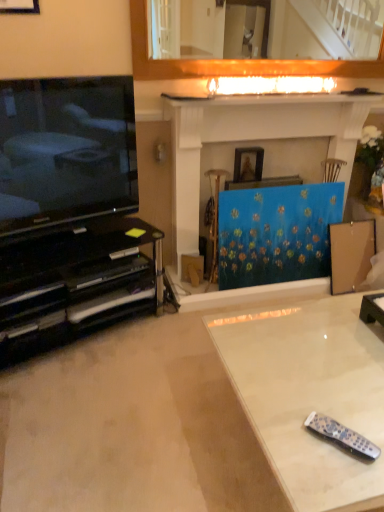
What are the coordinates of `vacant space situated on the left part of black plastic remote at lower right` in the screenshot? It's located at (286, 440).